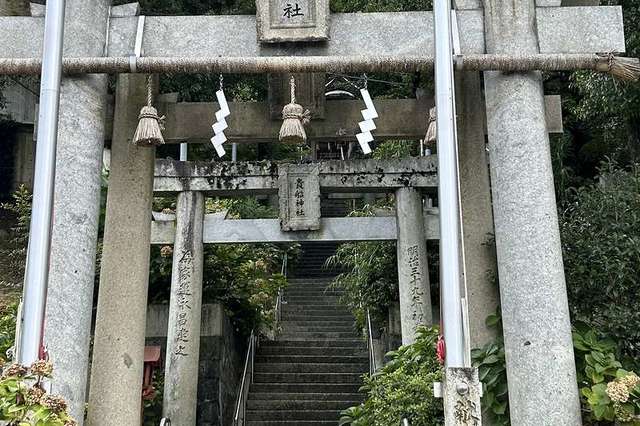
Image resolution: width=640 pixels, height=426 pixels. What are the coordinates of `lowest stair` in the screenshot? It's located at (308, 423).